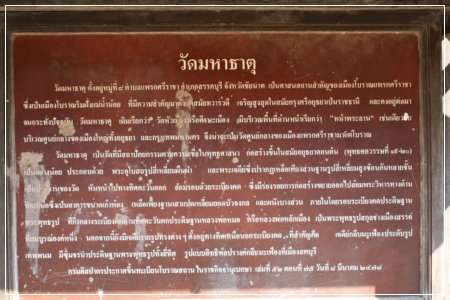
Find the location of a particular element. This screenshot has width=450, height=300. frame is located at coordinates (103, 24).